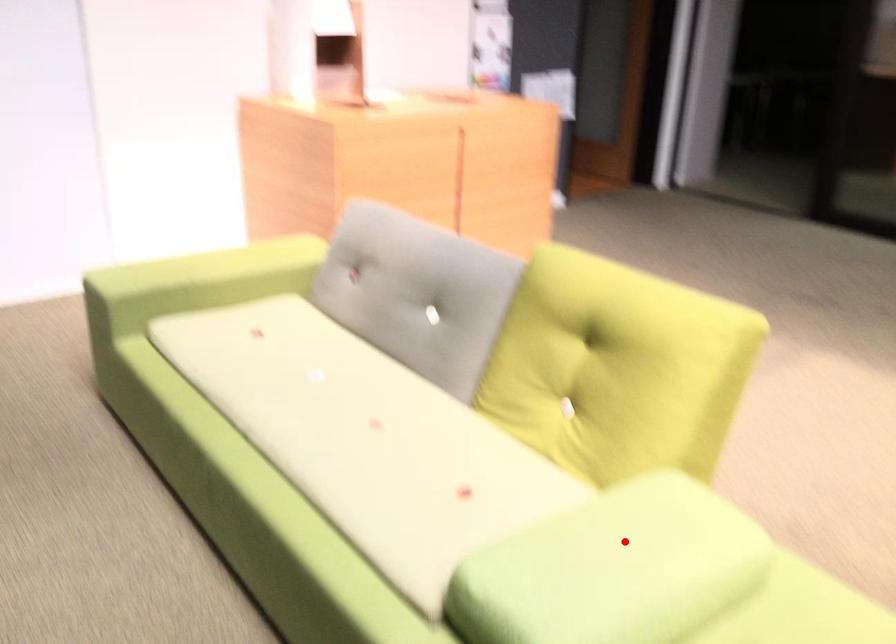
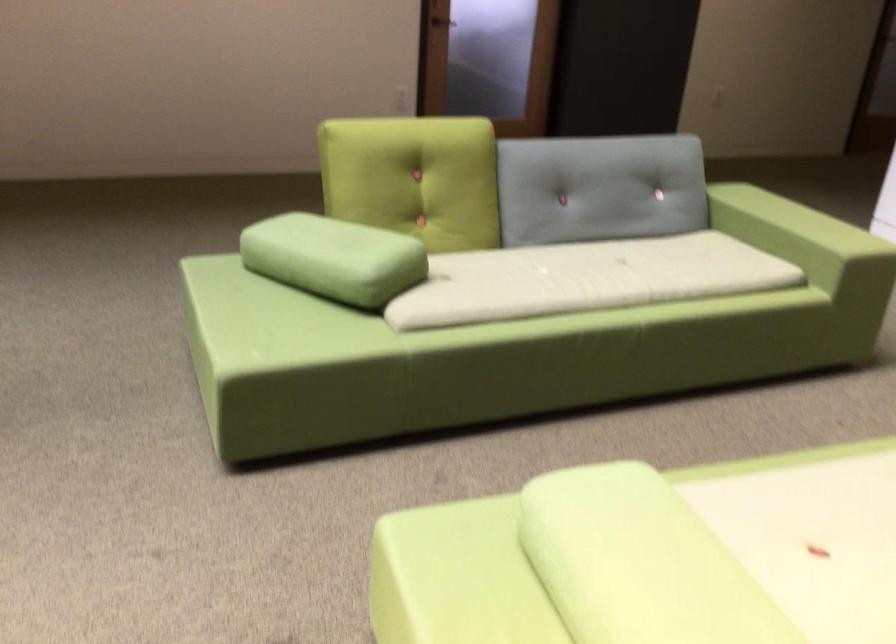
Question: I am providing you with two images of the same scene from different viewpoints. Given a red point in image1, look at the same physical point in image2. Is it:

Choices:
 (A) Closer to the viewpoint
 (B) Farther from the viewpoint

Answer: (A)